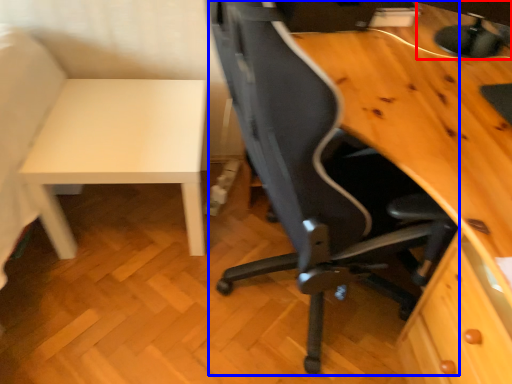
Question: Which of the following is the closest to the observer, computer monitor (highlighted by a red box) or chair (highlighted by a blue box)?

Choices:
 (A) computer monitor
 (B) chair

Answer: (B)